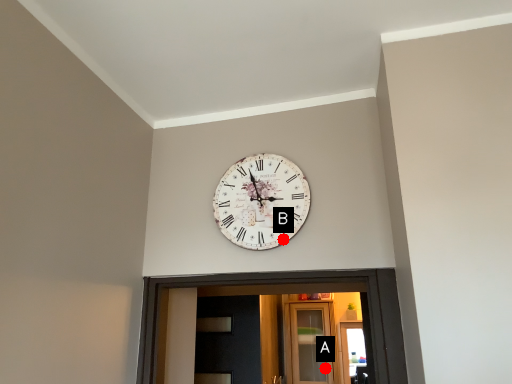
Question: Two points are circled on the image, labeled by A and B beside each circle. Which point appears closest to the camera in this image?

Choices:
 (A) A is closer
 (B) B is closer

Answer: (B)